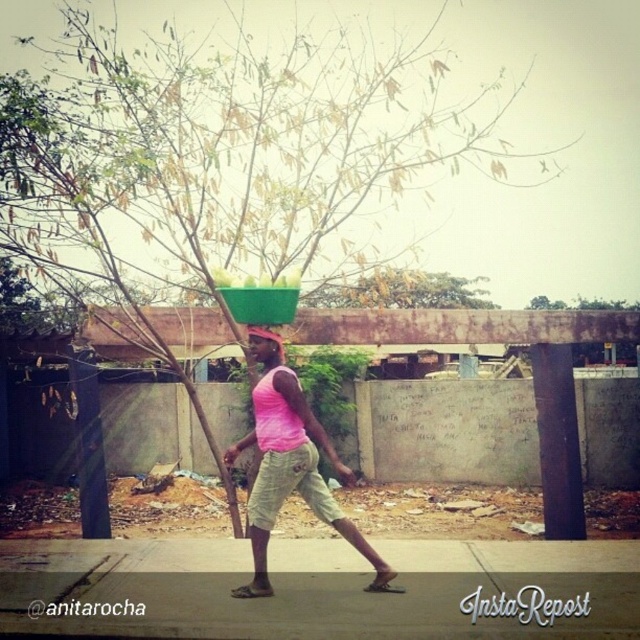
Question: Is gray concrete pavement at lower center positioned behind pink fabric tank top at center?

Choices:
 (A) no
 (B) yes

Answer: (A)

Question: Does gray concrete pavement at lower center appear on the left side of pink fabric head at center?

Choices:
 (A) no
 (B) yes

Answer: (B)

Question: Which point is closer to the camera?

Choices:
 (A) pink fabric tank top at center
 (B) gray concrete pavement at lower center

Answer: (B)

Question: Estimate the real-world distances between objects in this image. Which object is farther from the pink fabric head at center?

Choices:
 (A) pink fabric tank top at center
 (B) gray concrete pavement at lower center

Answer: (B)

Question: Where is gray concrete pavement at lower center located in relation to pink fabric head at center in the image?

Choices:
 (A) above
 (B) below

Answer: (B)

Question: Which point is farther to the camera?

Choices:
 (A) (35, 628)
 (B) (298, 448)

Answer: (B)